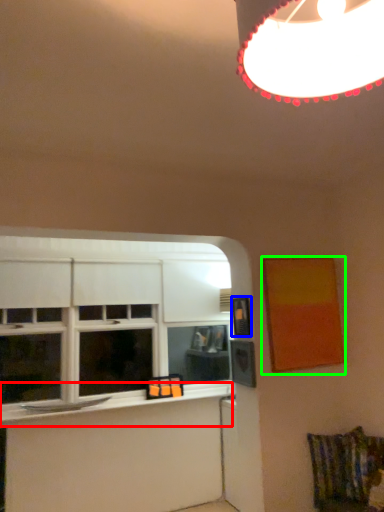
Question: Estimate the real-world distances between objects in this image. Which object is farther from window sill (highlighted by a red box), picture frame (highlighted by a blue box) or picture frame (highlighted by a green box)?

Choices:
 (A) picture frame
 (B) picture frame

Answer: (B)